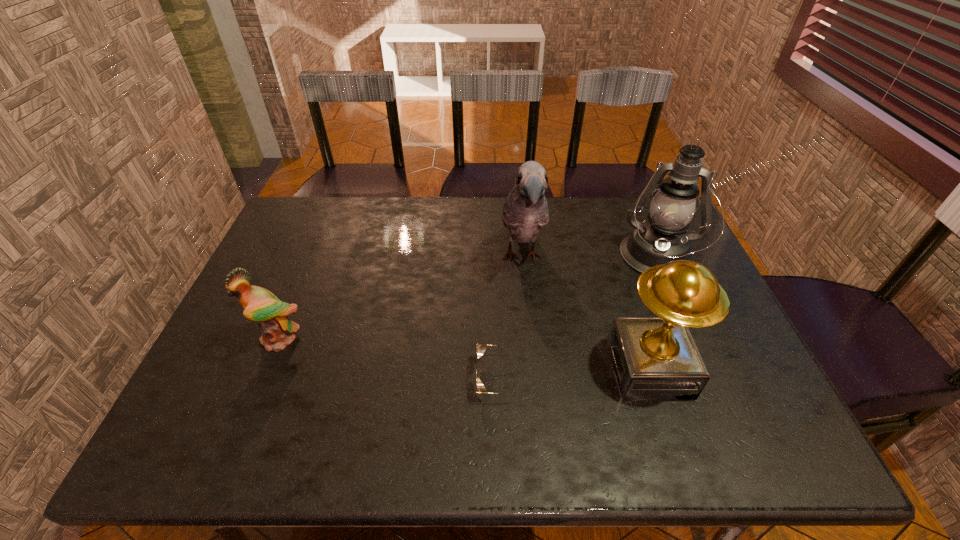
Where is `oil lamp`? The width and height of the screenshot is (960, 540). oil lamp is located at coordinates (662, 239).

You are a GUI agent. You are given a task and a screenshot of the screen. Output one action in this format:
    pyautogui.click(x=<x>, y=<y>)
    Task: Click on the right parrot
    The image size is (960, 540).
    Given the screenshot: What is the action you would take?
    pyautogui.click(x=525, y=211)

Where is `the taller parrot`? the taller parrot is located at coordinates (525, 211).

Find the location of `award`. award is located at coordinates (654, 357).

Locate an element on the screen. The height and width of the screenshot is (540, 960). the left parrot is located at coordinates (259, 304).

At what (x,y) coordinates should I click in order to perform the action: click on the fourth tallest object. Please return your answer as a coordinate pair (x, y). Looking at the image, I should click on (259, 304).

Image resolution: width=960 pixels, height=540 pixels. I want to click on the shortest object, so click(480, 388).

The width and height of the screenshot is (960, 540). In order to click on blank space located on the front of the oil lamp in this screenshot , I will do `click(683, 321)`.

You are a GUI agent. You are given a task and a screenshot of the screen. Output one action in this format:
    pyautogui.click(x=<x>, y=<y>)
    Task: Click on the vacant space located on the front-facing side of the farther parrot
    
    Given the screenshot: What is the action you would take?
    pyautogui.click(x=537, y=399)

The width and height of the screenshot is (960, 540). In order to click on free space located on the front-facing side of the award in this screenshot , I will do `click(470, 368)`.